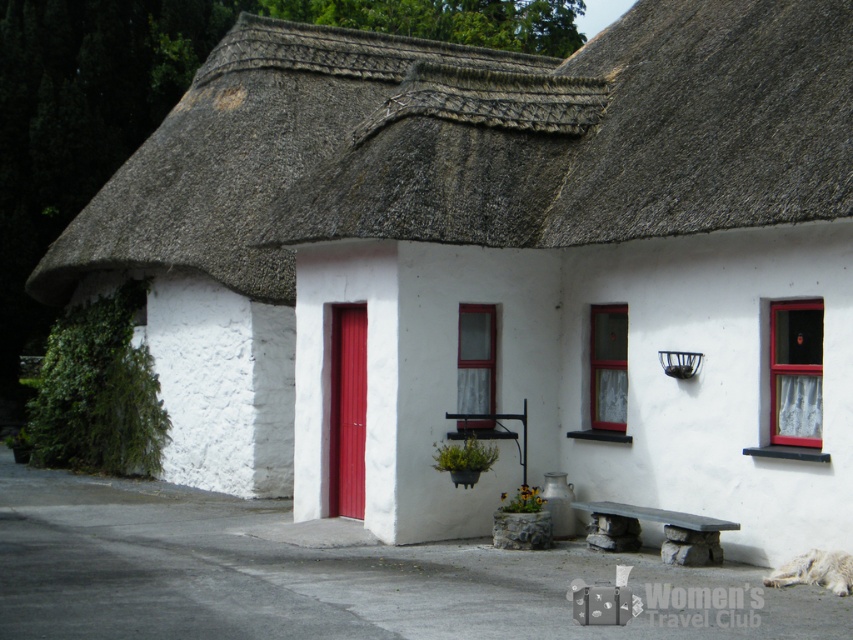
Is point (790, 420) positioned after point (590, 336)?

That is False.

Can you confirm if matte glass window at upper right is bigger than matte glass window at center?

No.

Find the location of a particular element. The image size is (853, 640). matte glass window at upper right is located at coordinates (796, 372).

Where is `matte glass window at upper right`? matte glass window at upper right is located at coordinates (796, 372).

Between matte glass window at center and clear glass window at center, which one has more height?

A: matte glass window at center is taller.

Is matte glass window at center smaller than clear glass window at center?

Incorrect, matte glass window at center is not smaller in size than clear glass window at center.

Which is behind, point (608, 369) or point (480, 400)?

Positioned behind is point (480, 400).

This screenshot has width=853, height=640. I want to click on matte glass window at center, so click(608, 365).

Is matte glass window at upper right positioned in front of smooth stone bench at center?

Yes, matte glass window at upper right is in front of smooth stone bench at center.

Is point (772, 305) positioned behind point (721, 522)?

Yes, it is.

The width and height of the screenshot is (853, 640). Find the location of `matte glass window at upper right`. matte glass window at upper right is located at coordinates (796, 372).